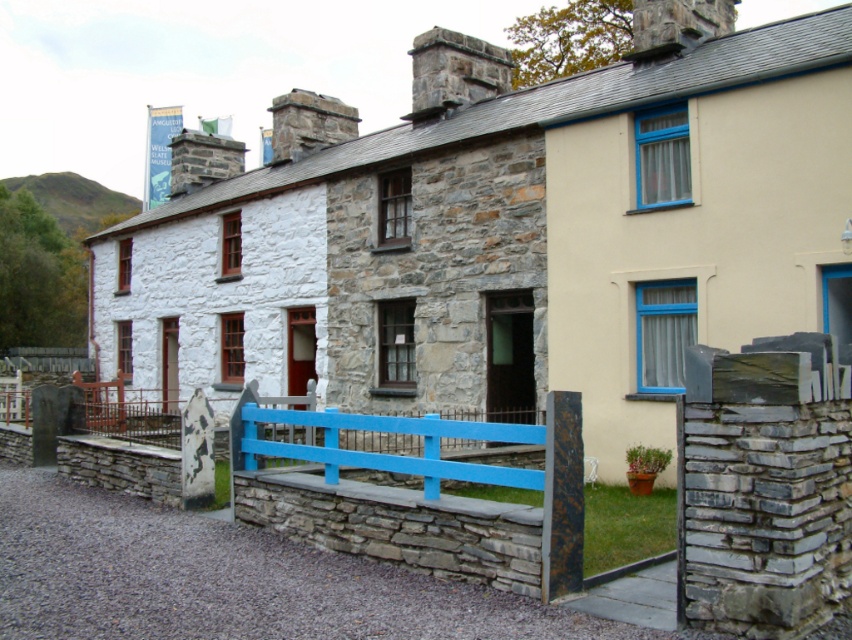
Is the position of stone cottage at center less distant than that of blue painted wood fence at center?

No, stone cottage at center is further to the viewer.

What do you see at coordinates (508, 230) in the screenshot? I see `stone cottage at center` at bounding box center [508, 230].

Measure the distance between stone cottage at center and camera.

stone cottage at center and camera are 33.04 feet apart from each other.

The height and width of the screenshot is (640, 852). In order to click on stone cottage at center in this screenshot , I will do `click(508, 230)`.

Consider the image. Does blue painted wood fence at center have a lesser height compared to blue painted wood rail at center?

No.

Which of these two, blue painted wood fence at center or blue painted wood rail at center, stands taller?

blue painted wood fence at center is taller.

The height and width of the screenshot is (640, 852). I want to click on blue painted wood fence at center, so click(x=422, y=493).

Between point (461, 352) and point (465, 436), which one is positioned behind?

The point (461, 352) is behind.

What do you see at coordinates (508, 230) in the screenshot?
I see `stone cottage at center` at bounding box center [508, 230].

Image resolution: width=852 pixels, height=640 pixels. What are the coordinates of `stone cottage at center` in the screenshot? It's located at (508, 230).